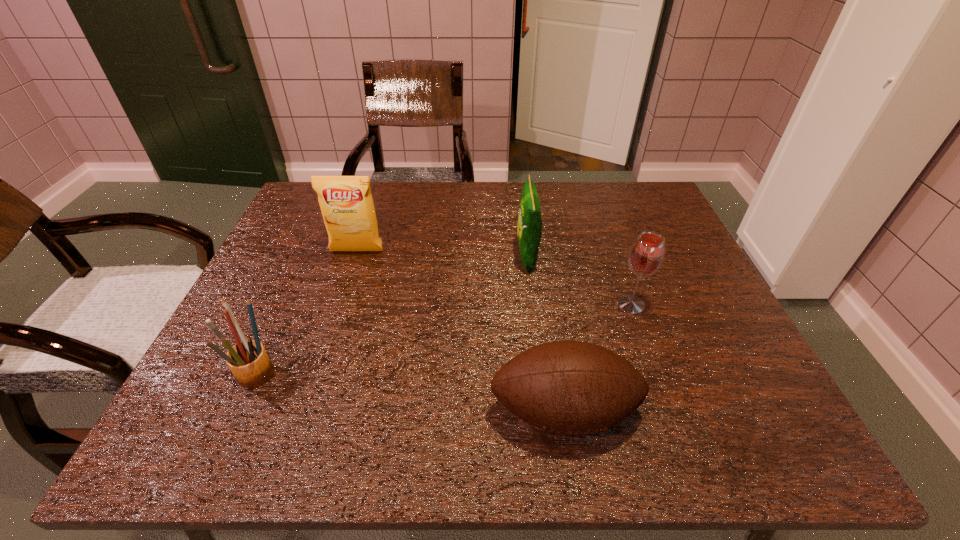
In the image, there is a desktop. At what (x,y) coordinates should I click in order to perform the action: click on blank space at the far right corner. Please return your answer as a coordinate pair (x, y). Looking at the image, I should click on (618, 192).

In the image, there is a desktop. Where is `blank space at the near right corner`? Image resolution: width=960 pixels, height=540 pixels. blank space at the near right corner is located at coordinates (721, 432).

The height and width of the screenshot is (540, 960). In order to click on vacant point located between the pencil box and the right crisp (potato chip) in this screenshot , I will do `click(393, 315)`.

At what (x,y) coordinates should I click in order to perform the action: click on free space between the right crisp (potato chip) and the wineglass. Please return your answer as a coordinate pair (x, y). Looking at the image, I should click on (579, 281).

Identify the location of free point between the right crisp (potato chip) and the football. This screenshot has width=960, height=540. (545, 335).

The image size is (960, 540). I want to click on vacant area that lies between the pencil box and the rightmost object, so click(445, 339).

Find the location of a particular element. The height and width of the screenshot is (540, 960). free space between the right crisp (potato chip) and the left crisp (potato chip) is located at coordinates (442, 254).

The image size is (960, 540). What are the coordinates of `empty location between the pencil box and the right crisp (potato chip)` in the screenshot? It's located at (393, 315).

What are the coordinates of `blank region between the left crisp (potato chip) and the pencil box` in the screenshot? It's located at (308, 312).

At what (x,y) coordinates should I click in order to perform the action: click on free space between the rightmost object and the left crisp (potato chip). Please return your answer as a coordinate pair (x, y). This screenshot has height=540, width=960. Looking at the image, I should click on (494, 278).